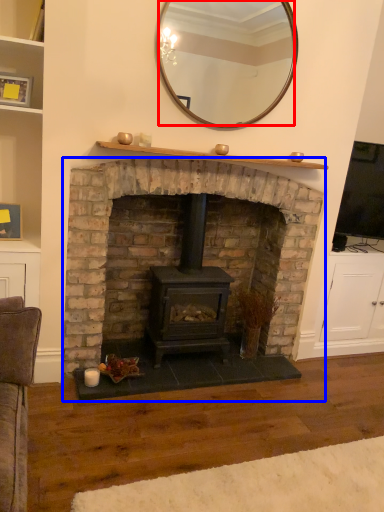
Question: Which of the following is the farthest to the observer, mirror (highlighted by a red box) or fireplace (highlighted by a blue box)?

Choices:
 (A) mirror
 (B) fireplace

Answer: (A)